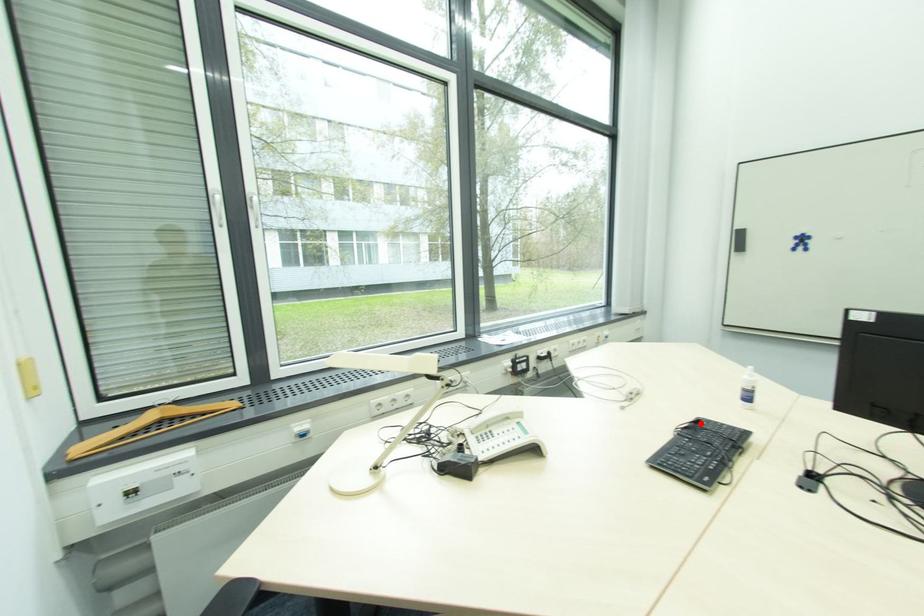
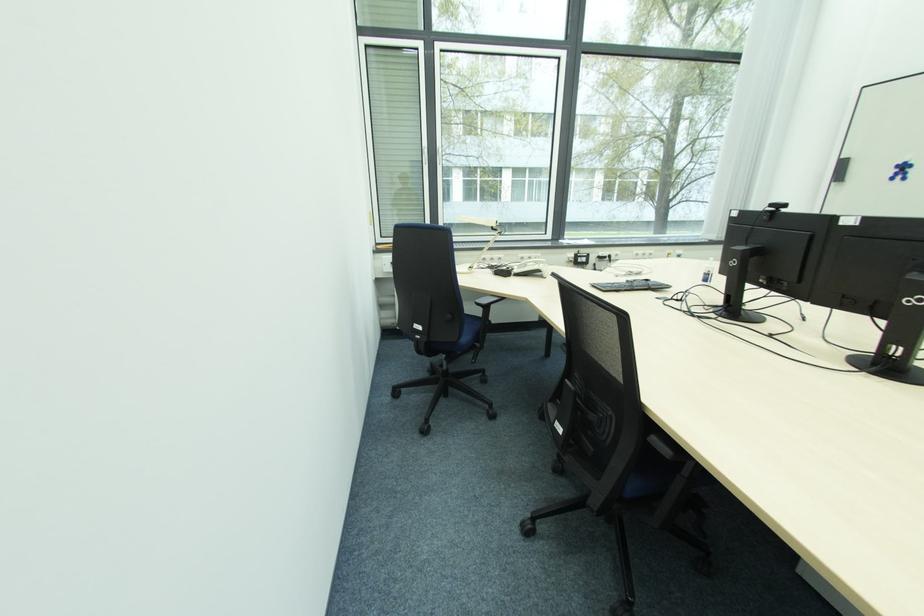
In the second image, find the point that corresponds to the highlighted location in the first image.

(650, 283)